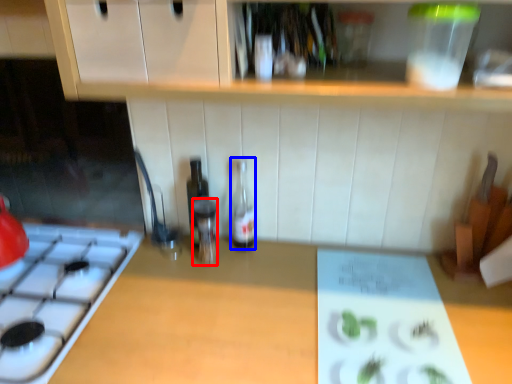
Question: Which object is further to the camera taking this photo, bottle (highlighted by a red box) or bottle (highlighted by a blue box)?

Choices:
 (A) bottle
 (B) bottle

Answer: (B)